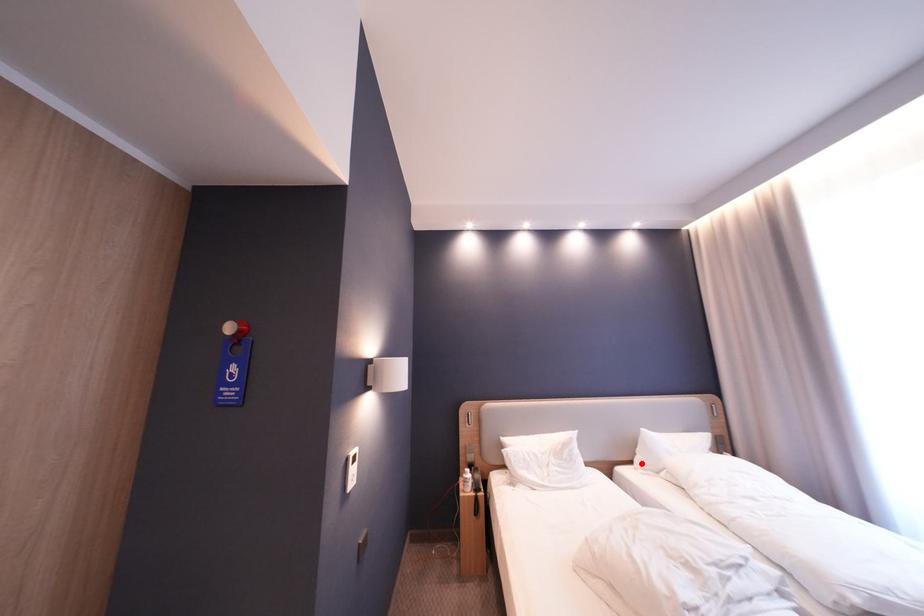
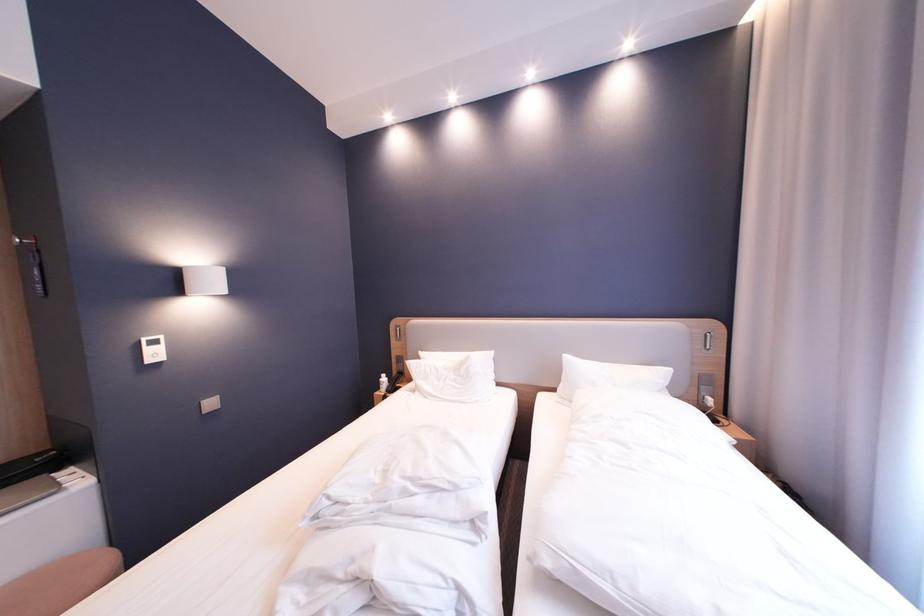
Where in the second image is the point corresponding to the highlighted location from the first image?

(565, 391)